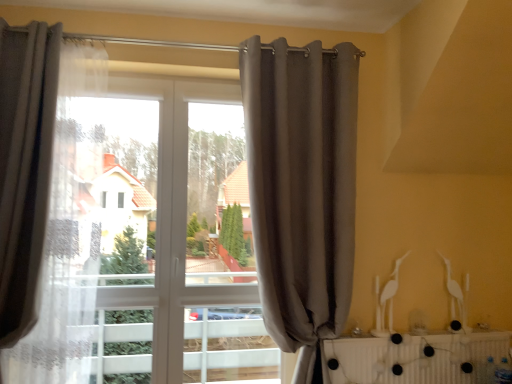
Question: Is matte gray curtain at left, which ranks as the 2th curtain in right-to-left order, oriented away from white plastic radiator at lower right?

Choices:
 (A) yes
 (B) no

Answer: (B)

Question: From a real-world perspective, is matte gray curtain at left, which ranks as the 2th curtain in right-to-left order, positioned under white plastic radiator at lower right based on gravity?

Choices:
 (A) no
 (B) yes

Answer: (A)

Question: Can you confirm if matte gray curtain at left, which ranks as the 2th curtain in right-to-left order, is thinner than white plastic radiator at lower right?

Choices:
 (A) yes
 (B) no

Answer: (B)

Question: Considering the relative sizes of matte gray curtain at left, placed as the first curtain when sorted from left to right, and white plastic radiator at lower right in the image provided, is matte gray curtain at left, placed as the first curtain when sorted from left to right, shorter than white plastic radiator at lower right?

Choices:
 (A) no
 (B) yes

Answer: (A)

Question: Is matte gray curtain at left, which ranks as the 2th curtain in right-to-left order, to the left of white plastic radiator at lower right from the viewer's perspective?

Choices:
 (A) no
 (B) yes

Answer: (B)

Question: From the image's perspective, is matte gray curtain at left, placed as the first curtain when sorted from left to right, beneath white plastic radiator at lower right?

Choices:
 (A) no
 (B) yes

Answer: (A)

Question: Is gray fabric curtain at center, which is the second curtain in left-to-right order, at the back of matte gray curtain at left, placed as the first curtain when sorted from left to right?

Choices:
 (A) yes
 (B) no

Answer: (B)

Question: Are matte gray curtain at left, placed as the first curtain when sorted from left to right, and gray fabric curtain at center, positioned as the first curtain in right-to-left order, making contact?

Choices:
 (A) no
 (B) yes

Answer: (A)

Question: Is matte gray curtain at left, which ranks as the 2th curtain in right-to-left order, to the right of gray fabric curtain at center, positioned as the first curtain in right-to-left order, from the viewer's perspective?

Choices:
 (A) no
 (B) yes

Answer: (A)

Question: Is matte gray curtain at left, placed as the first curtain when sorted from left to right, to the left of gray fabric curtain at center, positioned as the first curtain in right-to-left order, from the viewer's perspective?

Choices:
 (A) no
 (B) yes

Answer: (B)

Question: Does matte gray curtain at left, placed as the first curtain when sorted from left to right, have a lesser height compared to gray fabric curtain at center, positioned as the first curtain in right-to-left order?

Choices:
 (A) no
 (B) yes

Answer: (B)

Question: Does matte gray curtain at left, which ranks as the 2th curtain in right-to-left order, have a greater width compared to gray fabric curtain at center, positioned as the first curtain in right-to-left order?

Choices:
 (A) no
 (B) yes

Answer: (B)

Question: Is white plastic radiator at lower right facing away from gray fabric curtain at center, which is the second curtain in left-to-right order?

Choices:
 (A) yes
 (B) no

Answer: (B)